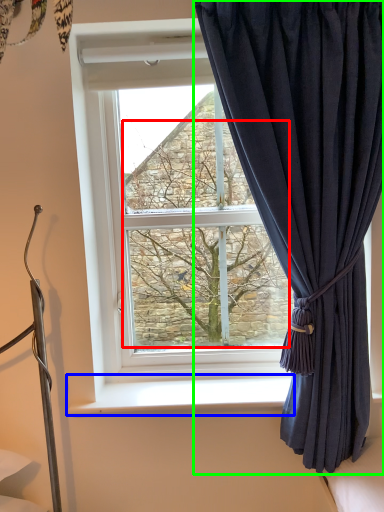
Question: Based on their relative distances, which object is nearer to tree (highlighted by a red box)? Choose from window sill (highlighted by a blue box) and curtain (highlighted by a green box).

Choices:
 (A) window sill
 (B) curtain

Answer: (B)